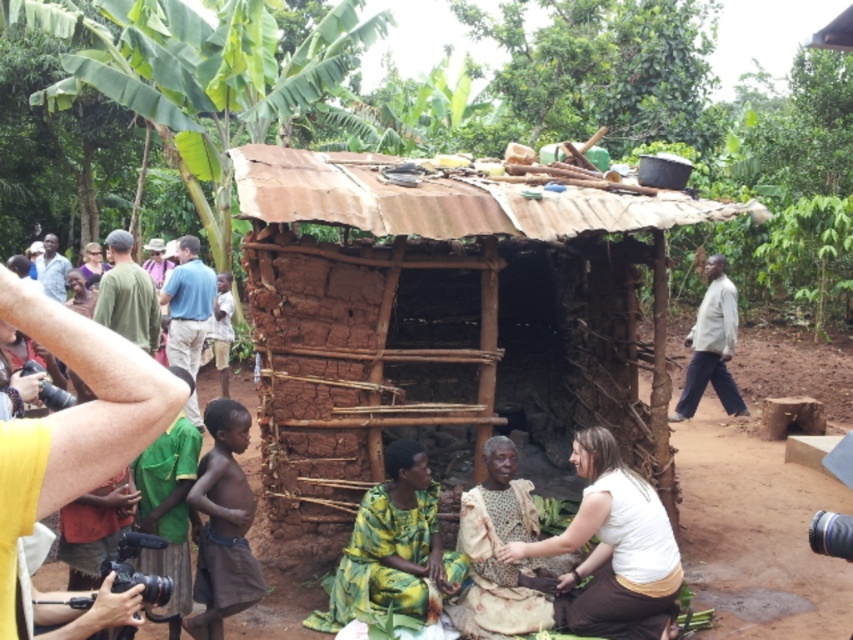
Question: Which object is the closest to the yellow-green fabric at center?

Choices:
 (A) white cotton shirt at center
 (B) brown cloth at lower left
 (C) white cotton shirt at right

Answer: (A)

Question: Which point appears farthest from the camera in this image?

Choices:
 (A) (682, 392)
 (B) (404, 545)

Answer: (A)

Question: Which point is closer to the camera?

Choices:
 (A) (236, 451)
 (B) (154, 307)
 (C) (408, 592)

Answer: (A)

Question: Is yellow-green fabric at center further to camera compared to white cotton shirt at right?

Choices:
 (A) no
 (B) yes

Answer: (A)

Question: Can you confirm if white cotton shirt at right is wider than matte brown shirt at left?

Choices:
 (A) yes
 (B) no

Answer: (A)

Question: Is white cotton shirt at center above brown cloth at lower left?

Choices:
 (A) no
 (B) yes

Answer: (A)